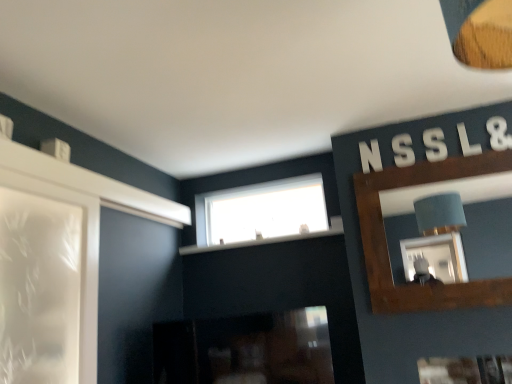
Question: Can you confirm if white plastic letter at upper right, placed as the 1th letter when sorted from right to left, is taller than white plastic letter n at upper right, which is the first letter in left-to-right order?

Choices:
 (A) yes
 (B) no

Answer: (A)

Question: Does white plastic letter at upper right, which ranks as the fifth letter in left-to-right order, touch white plastic letter n at upper right, acting as the fifth letter starting from the right?

Choices:
 (A) no
 (B) yes

Answer: (A)

Question: Does white plastic letter at upper right, placed as the 1th letter when sorted from right to left, appear on the right side of white plastic letter n at upper right, acting as the fifth letter starting from the right?

Choices:
 (A) no
 (B) yes

Answer: (B)

Question: Considering the relative sizes of white plastic letter at upper right, which ranks as the fifth letter in left-to-right order, and white plastic letter n at upper right, which is the first letter in left-to-right order, in the image provided, is white plastic letter at upper right, which ranks as the fifth letter in left-to-right order, smaller than white plastic letter n at upper right, which is the first letter in left-to-right order,?

Choices:
 (A) yes
 (B) no

Answer: (A)

Question: Does white plastic letter at upper right, which ranks as the fifth letter in left-to-right order, have a larger size compared to white plastic letter n at upper right, acting as the fifth letter starting from the right?

Choices:
 (A) no
 (B) yes

Answer: (A)

Question: Considering the positions of white plastic letter at upper right, which ranks as the fifth letter in left-to-right order, and white plastic letter at upper right, arranged as the second letter when viewed from the right, in the image, is white plastic letter at upper right, which ranks as the fifth letter in left-to-right order, bigger or smaller than white plastic letter at upper right, arranged as the second letter when viewed from the right,?

Choices:
 (A) small
 (B) big

Answer: (A)

Question: Considering the positions of white plastic letter at upper right, which ranks as the fifth letter in left-to-right order, and white plastic letter at upper right, arranged as the second letter when viewed from the right, in the image, is white plastic letter at upper right, which ranks as the fifth letter in left-to-right order, wider or thinner than white plastic letter at upper right, arranged as the second letter when viewed from the right,?

Choices:
 (A) wide
 (B) thin

Answer: (B)

Question: Visually, is white plastic letter at upper right, placed as the 1th letter when sorted from right to left, positioned to the left or to the right of white plastic letter at upper right, arranged as the second letter when viewed from the right?

Choices:
 (A) right
 (B) left

Answer: (A)

Question: In the image, is white plastic letter at upper right, placed as the 1th letter when sorted from right to left, positioned in front of or behind white plastic letter at upper right, arranged as the second letter when viewed from the right?

Choices:
 (A) front
 (B) behind

Answer: (A)

Question: In terms of width, does white plastic letter s at upper right, which is counted as the 2th letter, starting from the left, look wider or thinner when compared to white plastic letter at upper right, placed as the 1th letter when sorted from right to left?

Choices:
 (A) thin
 (B) wide

Answer: (A)

Question: Is point (398, 155) positioned closer to the camera than point (496, 150)?

Choices:
 (A) closer
 (B) farther

Answer: (B)

Question: From a real-world perspective, relative to white plastic letter at upper right, which ranks as the fifth letter in left-to-right order, is white plastic letter s at upper right, which is counted as the 2th letter, starting from the left, vertically above or below?

Choices:
 (A) below
 (B) above

Answer: (A)

Question: Is white plastic letter s at upper right, acting as the 4th letter starting from the right, to the left or to the right of white plastic letter at upper right, which ranks as the fifth letter in left-to-right order, in the image?

Choices:
 (A) left
 (B) right

Answer: (A)

Question: In the image, is white plastic letter s at upper right, acting as the 4th letter starting from the right, on the left side or the right side of white plastic letter n at upper right, which is the first letter in left-to-right order?

Choices:
 (A) left
 (B) right

Answer: (B)

Question: Considering their positions, is white plastic letter s at upper right, acting as the 4th letter starting from the right, located in front of or behind white plastic letter n at upper right, acting as the fifth letter starting from the right?

Choices:
 (A) front
 (B) behind

Answer: (A)